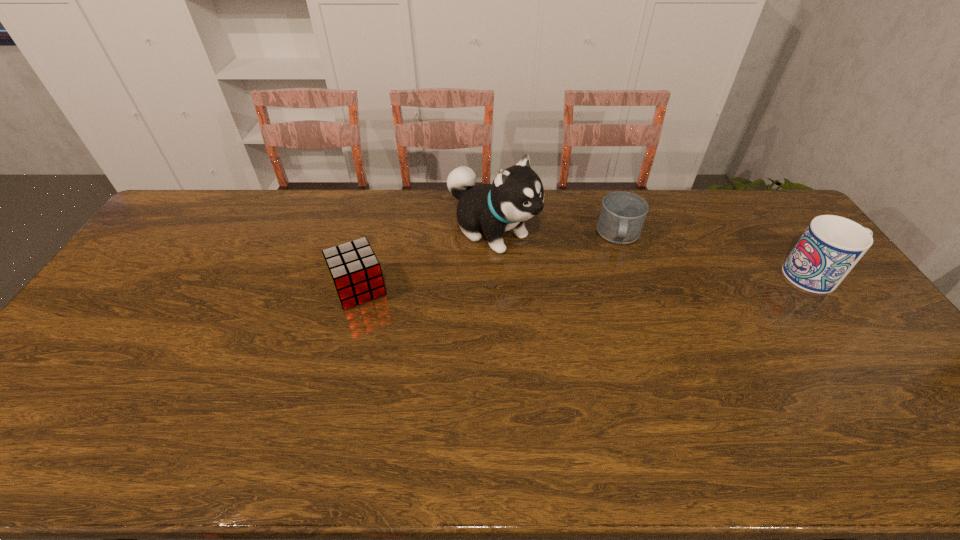
The height and width of the screenshot is (540, 960). Find the location of `vacant region located on the side of the shorter mug with the handle`. vacant region located on the side of the shorter mug with the handle is located at coordinates (618, 283).

Find the location of a particular element. This screenshot has width=960, height=540. vacant space located on the side of the shorter mug with the handle is located at coordinates (x=618, y=281).

I want to click on vacant space located at the face of the puppy, so click(586, 292).

This screenshot has height=540, width=960. Identify the location of free space located at the face of the puppy. (620, 314).

The image size is (960, 540). Identify the location of free space located 0.340m at the face of the puppy. (614, 310).

Where is `mug situated at the far edge`? The width and height of the screenshot is (960, 540). mug situated at the far edge is located at coordinates point(622,215).

You are a GUI agent. You are given a task and a screenshot of the screen. Output one action in this format:
    pyautogui.click(x=<x>, y=<y>)
    Task: Click on the puppy positioned at the far edge
    This screenshot has height=540, width=960.
    Given the screenshot: What is the action you would take?
    pyautogui.click(x=516, y=194)

The height and width of the screenshot is (540, 960). Find the location of `object located at the right edge`. object located at the right edge is located at coordinates click(x=831, y=246).

Image resolution: width=960 pixels, height=540 pixels. I want to click on vacant space at the far edge of the desktop, so coord(722,213).

The image size is (960, 540). Find the location of `free space at the near edge of the desktop`. free space at the near edge of the desktop is located at coordinates (841, 392).